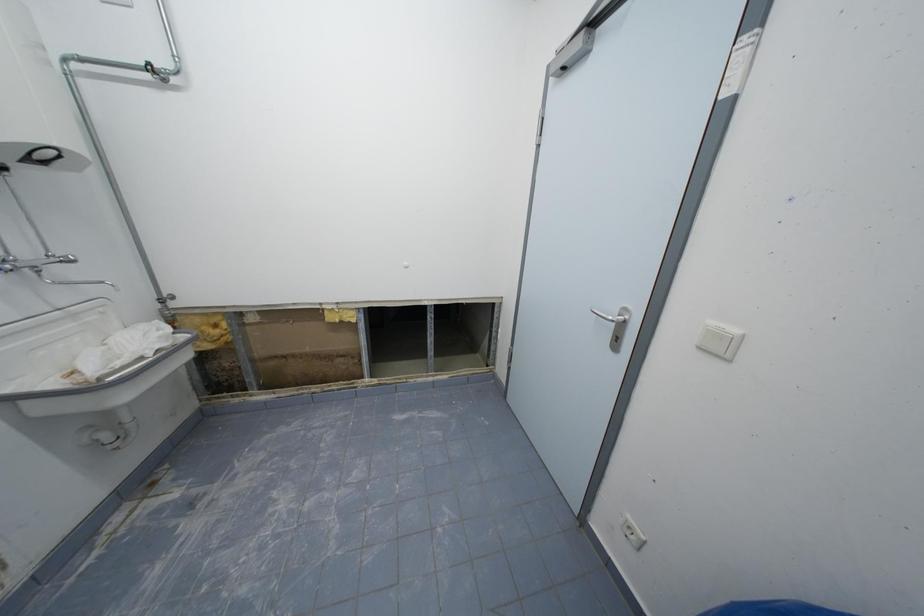
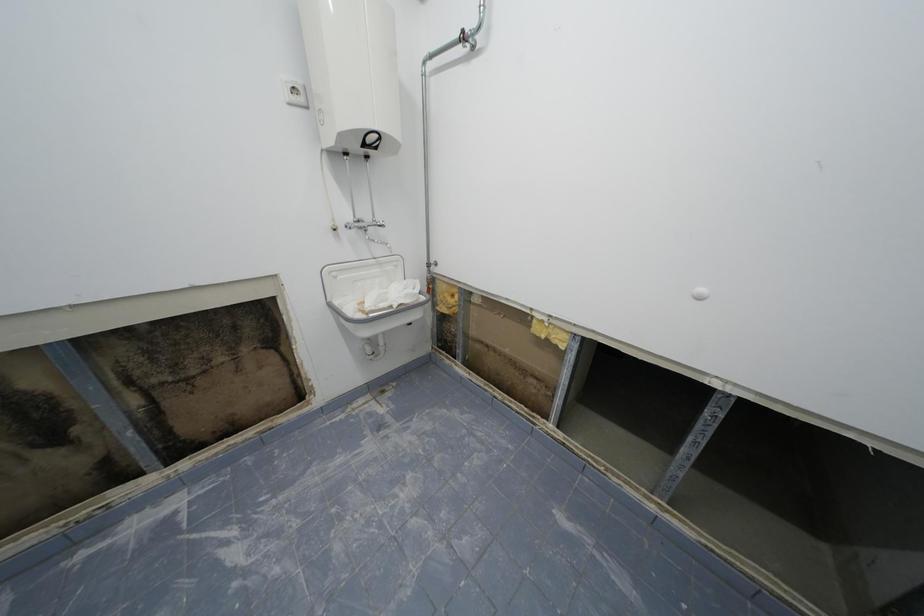
Question: The camera is either moving clockwise (left) or counter-clockwise (right) around the object. The first image is from the beginning of the video and the second image is from the end. Is the camera moving left or right when shooting the video?

Choices:
 (A) Left
 (B) Right

Answer: (B)